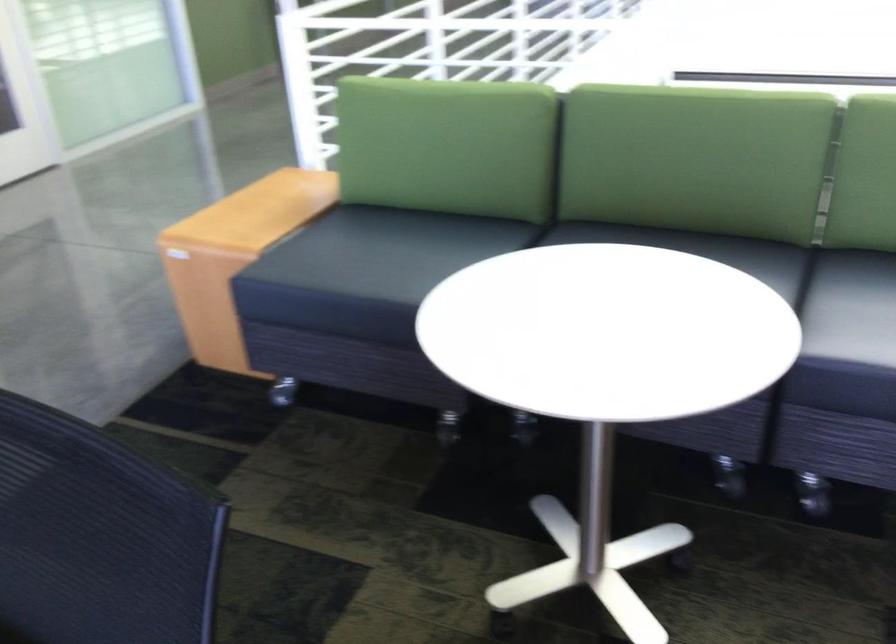
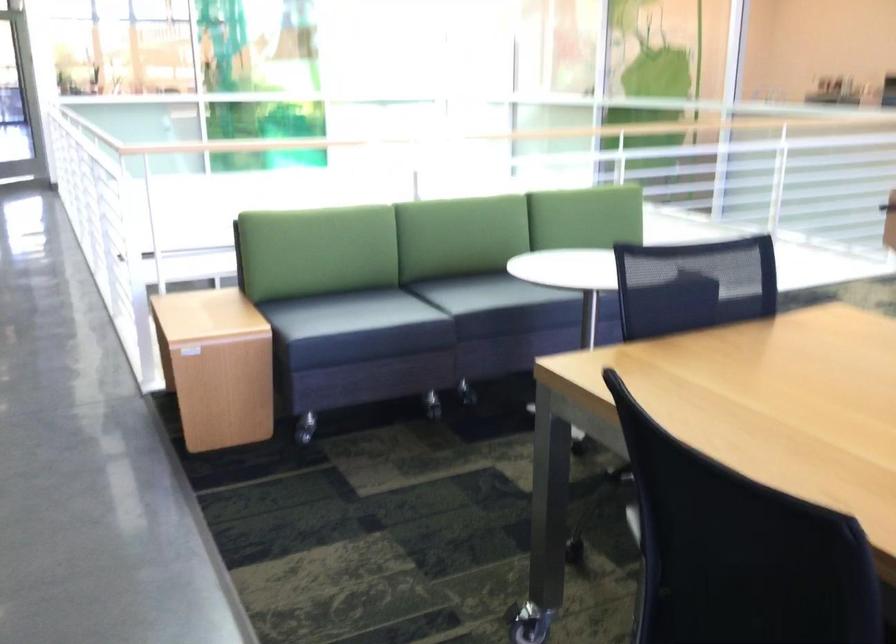
In the second image, find the point that corresponds to pixel 383 251 in the first image.

(285, 313)